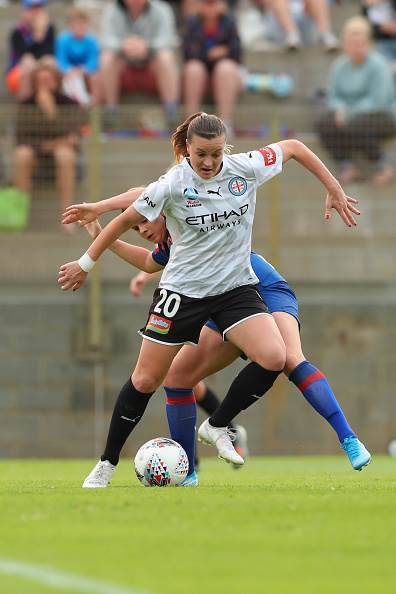
Locate an element on the screen. The image size is (396, 594). sock is located at coordinates (247, 391).